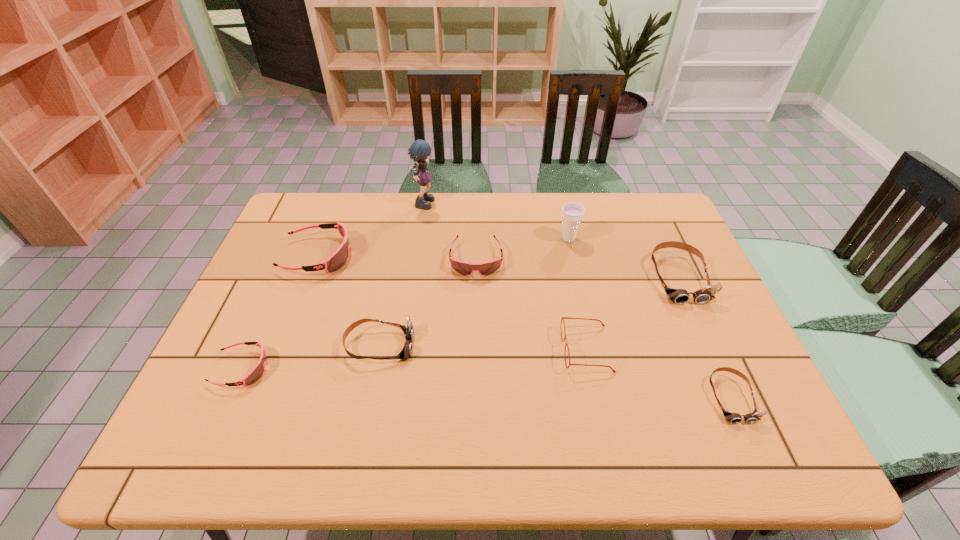
This screenshot has height=540, width=960. Find the location of `vacant region between the biggest pink goggles and the rag doll`. vacant region between the biggest pink goggles and the rag doll is located at coordinates (372, 228).

At what (x,y) coordinates should I click in order to perform the action: click on free space between the second smallest pink goggles and the biggest brown goggles. Please return your answer as a coordinate pair (x, y). Looking at the image, I should click on (577, 268).

Where is `blank region between the smallest brown goggles and the biggest pink goggles`? blank region between the smallest brown goggles and the biggest pink goggles is located at coordinates (524, 327).

Find the location of `vacant area that lies between the nearest pink goggles and the purple cup`. vacant area that lies between the nearest pink goggles and the purple cup is located at coordinates (405, 303).

Locate an element on the screen. This screenshot has width=960, height=540. vacant space that's between the spectacles and the biggest pink goggles is located at coordinates (452, 302).

Locate an element on the screen. The width and height of the screenshot is (960, 540). object that is the third closest to the rag doll is located at coordinates (572, 213).

Identify which object is the closest to the smallest brown goggles. Please provide its 2D coordinates. Your answer should be formatted as a tuple, i.e. [(x, y)], where the tuple contains the x and y coordinates of a point satisfying the conditions above.

[(563, 318)]

Locate an element on the screen. This screenshot has width=960, height=540. goggles identified as the sixth closest to the blue rag doll is located at coordinates (734, 418).

Identify which goggles is the closest to the rightmost pink goggles. Please provide its 2D coordinates. Your answer should be formatted as a tuple, i.e. [(x, y)], where the tuple contains the x and y coordinates of a point satisfying the conditions above.

[(408, 330)]

Select which pink goggles appears as the closest to the biggest pink goggles. Please provide its 2D coordinates. Your answer should be formatted as a tuple, i.e. [(x, y)], where the tuple contains the x and y coordinates of a point satisfying the conditions above.

[(256, 373)]